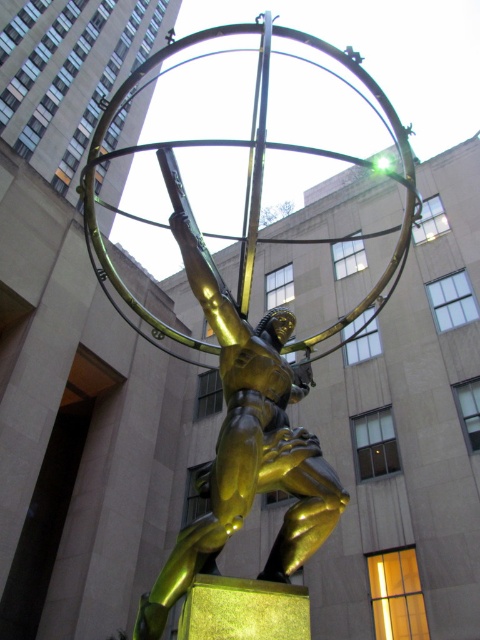
Question: Which point appears farthest from the camera in this image?

Choices:
 (A) (242, 518)
 (B) (303, 432)

Answer: (B)

Question: Among these objects, which one is nearest to the camera?

Choices:
 (A) gold polished statue at center
 (B) shiny gold statue at center

Answer: (B)

Question: From the image, what is the correct spatial relationship of shiny gold statue at center in relation to gold polished statue at center?

Choices:
 (A) left
 (B) right

Answer: (B)

Question: Is shiny gold statue at center closer to camera compared to gold polished statue at center?

Choices:
 (A) no
 (B) yes

Answer: (B)

Question: Is shiny gold statue at center smaller than gold polished statue at center?

Choices:
 (A) no
 (B) yes

Answer: (A)